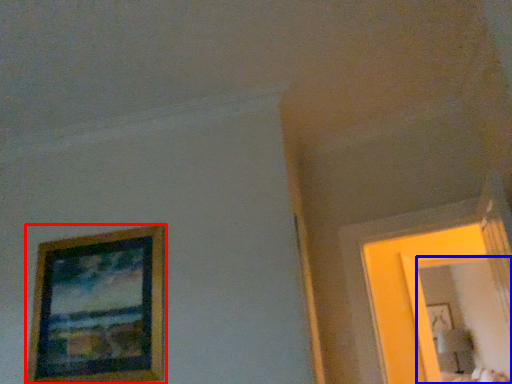
Question: Which point is further to the camera, picture frame (highlighted by a red box) or mirror (highlighted by a blue box)?

Choices:
 (A) picture frame
 (B) mirror

Answer: (B)